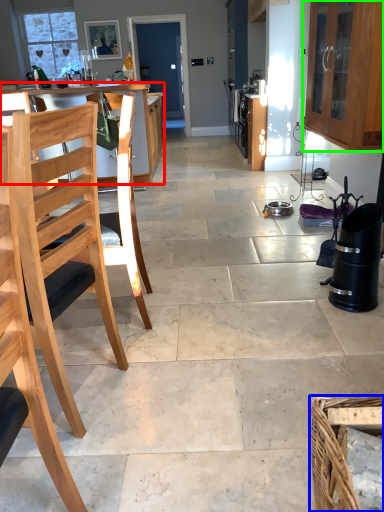
Question: Which object is positioned closest to table (highlighted by a red box)? Select from basket (highlighted by a blue box) and cabinetry (highlighted by a green box).

Choices:
 (A) basket
 (B) cabinetry

Answer: (B)